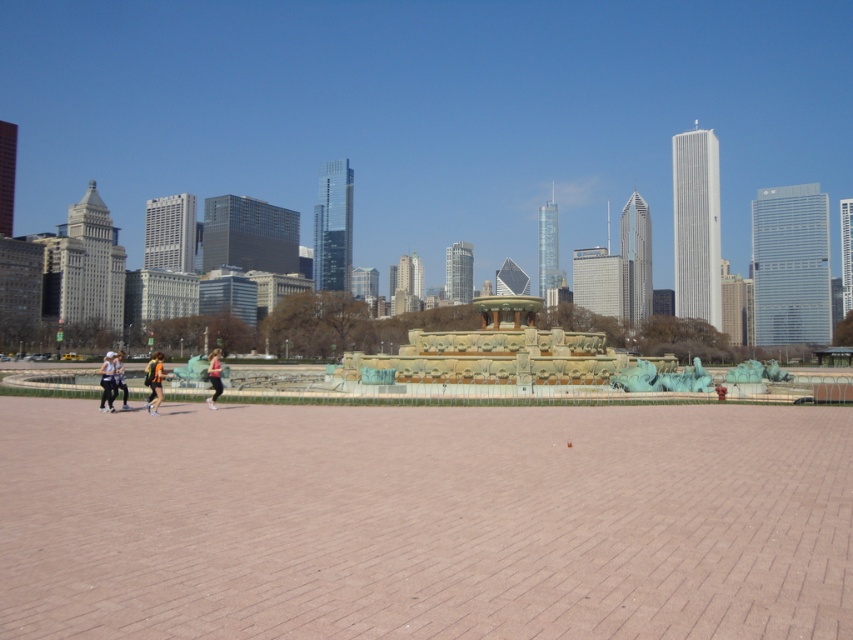
Who is positioned more to the left, matte black jacket at lower left or matte pink leggings at center?

From the viewer's perspective, matte black jacket at lower left appears more on the left side.

Between matte black jacket at lower left and matte pink leggings at center, which one is positioned lower?

Positioned lower is matte black jacket at lower left.

Where is `matte black jacket at lower left`? The height and width of the screenshot is (640, 853). matte black jacket at lower left is located at coordinates (107, 381).

Describe the element at coordinates (154, 381) in the screenshot. Image resolution: width=853 pixels, height=640 pixels. I see `orange athletic wear at center` at that location.

The width and height of the screenshot is (853, 640). I want to click on orange athletic wear at center, so click(x=154, y=381).

Where is `orange athletic wear at center`? orange athletic wear at center is located at coordinates (154, 381).

Is point (157, 384) closer to viewer compared to point (109, 352)?

Yes, point (157, 384) is in front of point (109, 352).

You are a GUI agent. You are given a task and a screenshot of the screen. Output one action in this format:
    pyautogui.click(x=<x>, y=<y>)
    Task: Click on the orange athletic wear at center
    This screenshot has height=640, width=853.
    Given the screenshot: What is the action you would take?
    pyautogui.click(x=154, y=381)